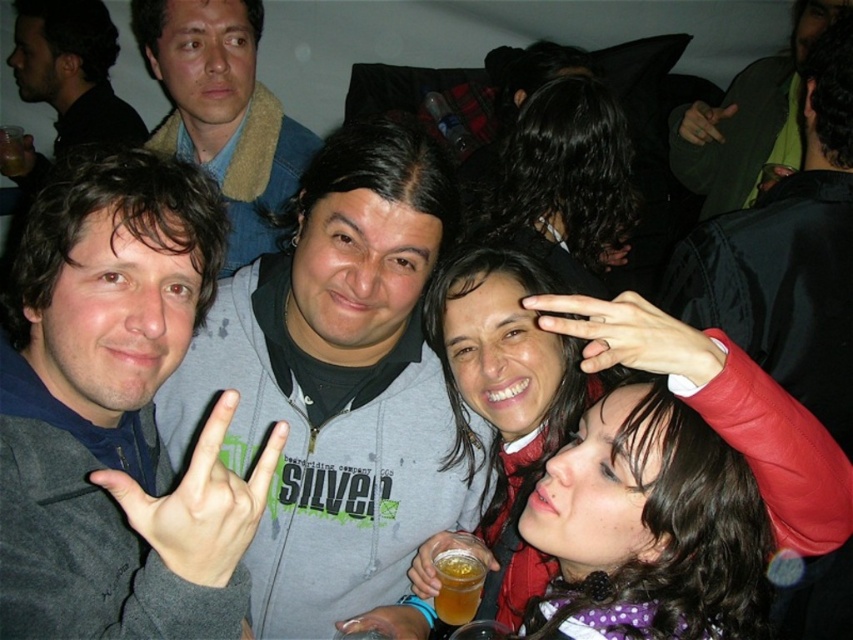
Question: Considering the relative positions of dark green textured jacket at upper right and translucent plastic cup at center in the image provided, where is dark green textured jacket at upper right located with respect to translucent plastic cup at center?

Choices:
 (A) left
 (B) right

Answer: (B)

Question: Which object appears closest to the camera in this image?

Choices:
 (A) black matte jacket at upper right
 (B) gray fleece hoodie at center
 (C) matte gray hoodie at center

Answer: (B)

Question: Does gray zip-up hoodie at center have a greater width compared to gray/green fabric hand at center?

Choices:
 (A) yes
 (B) no

Answer: (A)

Question: Can you confirm if gray fleece hoodie at center is positioned to the left of black matte jacket at upper right?

Choices:
 (A) yes
 (B) no

Answer: (A)

Question: Which object is positioned farthest from the black matte jacket at upper right?

Choices:
 (A) dark skin hand at lower center
 (B) blue denim jacket at upper left
 (C) gray fleece hoodie at center

Answer: (C)

Question: Among these objects, which one is nearest to the camera?

Choices:
 (A) blue denim jacket at upper left
 (B) matte black hand at upper center
 (C) translucent plastic cup at lower center

Answer: (B)